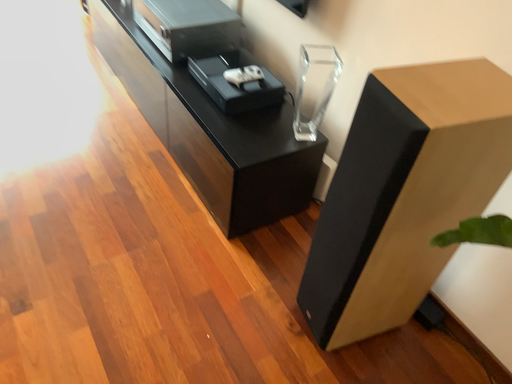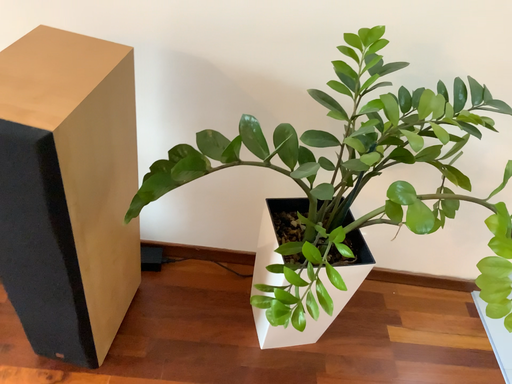
Question: Which way did the camera rotate in the video?

Choices:
 (A) rotated downward
 (B) rotated upward

Answer: (B)